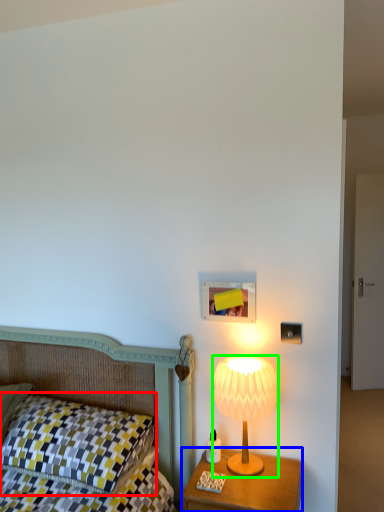
Question: Which is farther away from pillow (highlighted by a red box)? nightstand (highlighted by a blue box) or lamp (highlighted by a green box)?

Choices:
 (A) nightstand
 (B) lamp

Answer: (B)